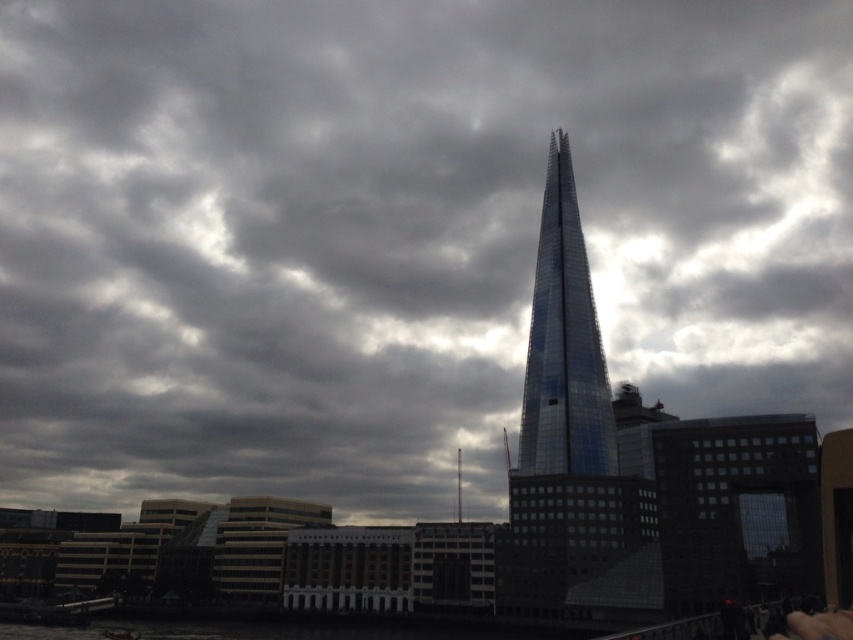
Question: Can you confirm if shiny glass tower at center is positioned to the left of glassy metallic spire at center?

Choices:
 (A) no
 (B) yes

Answer: (A)

Question: Which object is positioned farthest from the glassy steel tower at center?

Choices:
 (A) glassy metallic spire at center
 (B) shiny glass tower at center

Answer: (A)

Question: Estimate the real-world distances between objects in this image. Which object is closer to the glassy steel tower at center?

Choices:
 (A) shiny glass tower at center
 (B) glassy metallic spire at center

Answer: (A)

Question: Observing the image, what is the correct spatial positioning of glassy steel tower at center in reference to shiny glass tower at center?

Choices:
 (A) right
 (B) left

Answer: (A)

Question: Can you confirm if glassy steel tower at center is smaller than shiny glass tower at center?

Choices:
 (A) no
 (B) yes

Answer: (A)

Question: Which of the following is the closest to the observer?

Choices:
 (A) glassy steel tower at center
 (B) glassy metallic spire at center
 (C) shiny glass tower at center

Answer: (A)